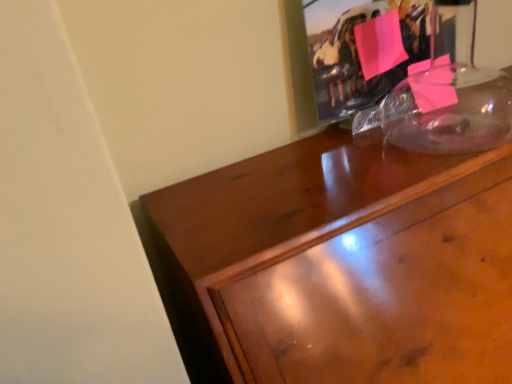
Where is `vacant point to the right of pink paper at upper center`? The width and height of the screenshot is (512, 384). vacant point to the right of pink paper at upper center is located at coordinates (465, 107).